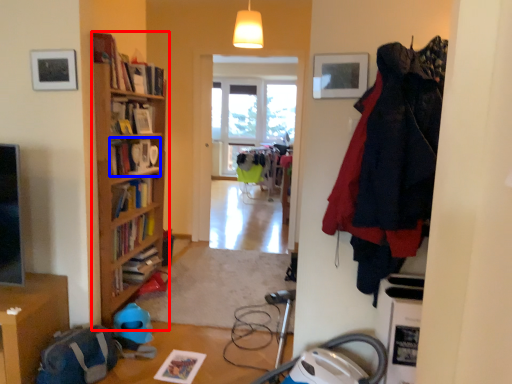
Question: Which point is closer to the camera, bookcase (highlighted by a red box) or book (highlighted by a blue box)?

Choices:
 (A) bookcase
 (B) book

Answer: (A)